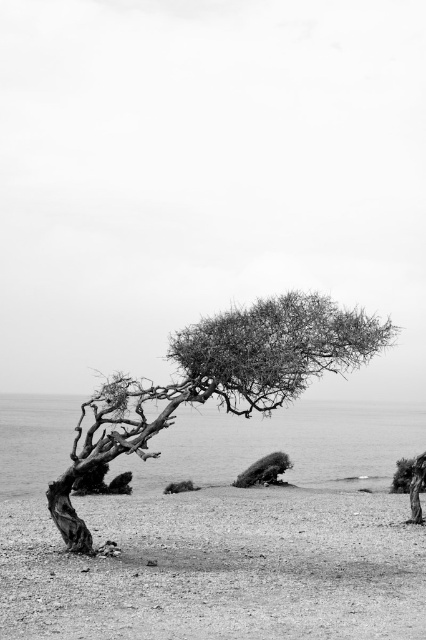
Question: Which point appears closest to the camera in this image?

Choices:
 (A) (173, 486)
 (B) (253, 572)
 (C) (58, 520)

Answer: (B)

Question: Which point is closer to the camera taking this photo?

Choices:
 (A) (273, 305)
 (B) (181, 486)

Answer: (A)

Question: From the image, what is the correct spatial relationship of thorny bark tree at center in relation to fuzzy fur animal at center?

Choices:
 (A) below
 (B) above

Answer: (B)

Question: Where is thorny bark tree at center located in relation to fuzzy fur animal at center in the image?

Choices:
 (A) above
 (B) below

Answer: (A)

Question: Which point is closer to the camera?

Choices:
 (A) thorny bark tree at center
 (B) fuzzy fur animal at center

Answer: (A)

Question: Is smooth sand at lower left smaller than fuzzy fur animal at center?

Choices:
 (A) yes
 (B) no

Answer: (B)